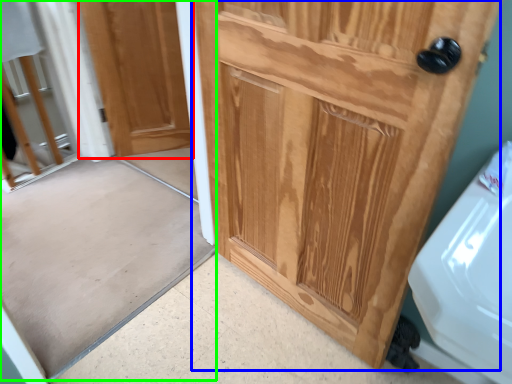
Question: Based on their relative distances, which object is farther from door (highlighted by a red box)? Choose from door (highlighted by a blue box) and screen door (highlighted by a green box).

Choices:
 (A) door
 (B) screen door

Answer: (A)